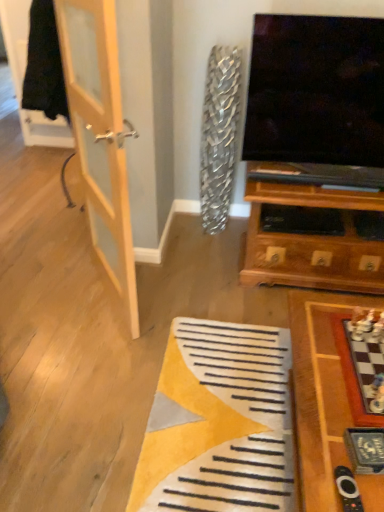
The height and width of the screenshot is (512, 384). I want to click on free space behind wooden chessboard at lower right, so click(x=243, y=334).